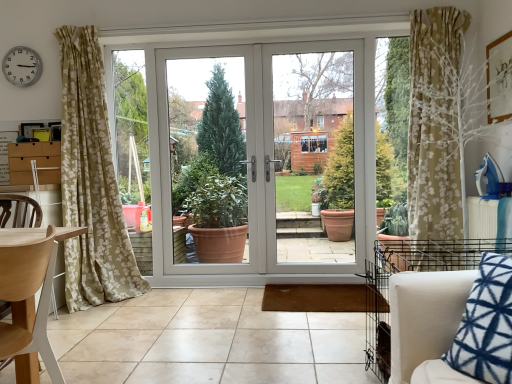
Question: From a real-world perspective, is beige tile at center on light wood chair at left?

Choices:
 (A) no
 (B) yes

Answer: (A)

Question: Does beige tile at center have a larger size compared to light wood chair at left?

Choices:
 (A) yes
 (B) no

Answer: (A)

Question: Could you tell me if beige tile at center is facing light wood chair at left?

Choices:
 (A) no
 (B) yes

Answer: (A)

Question: Is beige tile at center directly adjacent to light wood chair at left?

Choices:
 (A) no
 (B) yes

Answer: (A)

Question: Is beige tile at center in front of light wood chair at left?

Choices:
 (A) no
 (B) yes

Answer: (A)

Question: Considering the relative positions of beige tile at center and light wood chair at left in the image provided, is beige tile at center to the right of light wood chair at left from the viewer's perspective?

Choices:
 (A) yes
 (B) no

Answer: (A)

Question: Is beige tile at center bigger than silver metallic clock at upper left?

Choices:
 (A) no
 (B) yes

Answer: (B)

Question: From the image's perspective, is beige tile at center on top of silver metallic clock at upper left?

Choices:
 (A) yes
 (B) no

Answer: (B)

Question: From a real-world perspective, is beige tile at center physically below silver metallic clock at upper left?

Choices:
 (A) no
 (B) yes

Answer: (B)

Question: Is silver metallic clock at upper left located within beige tile at center?

Choices:
 (A) no
 (B) yes

Answer: (A)

Question: From the image's perspective, is beige tile at center beneath silver metallic clock at upper left?

Choices:
 (A) no
 (B) yes

Answer: (B)

Question: Is beige tile at center outside silver metallic clock at upper left?

Choices:
 (A) no
 (B) yes

Answer: (B)

Question: Considering the relative sizes of white glossy door at center and silver metallic clock at upper left in the image provided, is white glossy door at center smaller than silver metallic clock at upper left?

Choices:
 (A) yes
 (B) no

Answer: (B)